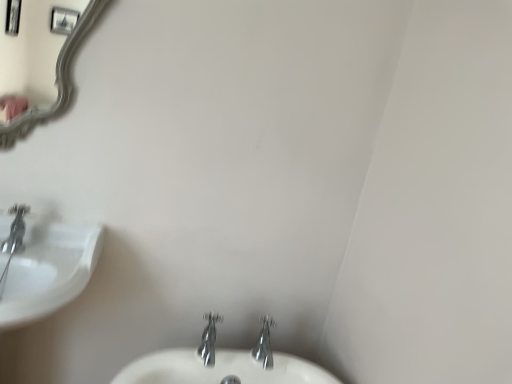
At what (x,y) coordinates should I click in order to perform the action: click on chrome metallic faucet at lower center, placed as the 1th tap when sorted from right to left. Please return your answer as a coordinate pair (x, y). Looking at the image, I should click on (264, 343).

From a real-world perspective, does chrome metallic faucet at lower center, placed as the 1th tap when sorted from right to left, sit lower than polished chrome faucet at center, which ranks as the 1th tap in left-to-right order?

Incorrect, from a real-world perspective, chrome metallic faucet at lower center, placed as the 1th tap when sorted from right to left, is higher than polished chrome faucet at center, which ranks as the 1th tap in left-to-right order.

Considering the relative sizes of chrome metallic faucet at lower center, placed as the 1th tap when sorted from right to left, and polished chrome faucet at center, which ranks as the 1th tap in left-to-right order, in the image provided, is chrome metallic faucet at lower center, placed as the 1th tap when sorted from right to left, taller than polished chrome faucet at center, which ranks as the 1th tap in left-to-right order,?

Yes, chrome metallic faucet at lower center, placed as the 1th tap when sorted from right to left, is taller than polished chrome faucet at center, which ranks as the 1th tap in left-to-right order.

From the image's perspective, is chrome metallic faucet at lower center, placed as the 1th tap when sorted from right to left, located above polished chrome faucet at center, which ranks as the 1th tap in left-to-right order?

No, from the image's perspective, chrome metallic faucet at lower center, placed as the 1th tap when sorted from right to left, is not on top of polished chrome faucet at center, which ranks as the 1th tap in left-to-right order.

How far apart are chrome metallic faucet at lower center, placed as the 1th tap when sorted from right to left, and polished chrome faucet at center, which ranks as the 1th tap in left-to-right order?

They are 7.00 inches apart.

What's the angular difference between polished chrome faucet at center, which ranks as the 1th tap in left-to-right order, and chrome metallic faucet at lower center, arranged as the 2th tap when viewed from the left,'s facing directions?

The angle between the facing direction of polished chrome faucet at center, which ranks as the 1th tap in left-to-right order, and the facing direction of chrome metallic faucet at lower center, arranged as the 2th tap when viewed from the left, is 1.03 degrees.

Is polished chrome faucet at center, which ranks as the 1th tap in left-to-right order, looking in the opposite direction of chrome metallic faucet at lower center, placed as the 1th tap when sorted from right to left?

No, polished chrome faucet at center, which ranks as the 1th tap in left-to-right order, is not facing the opposite direction of chrome metallic faucet at lower center, placed as the 1th tap when sorted from right to left.

Are polished chrome faucet at center, which ranks as the 1th tap in left-to-right order, and chrome metallic faucet at lower center, placed as the 1th tap when sorted from right to left, located far from each other?

No.

Is white glossy sink at left located outside chrome metallic faucet at lower center, arranged as the 2th tap when viewed from the left?

Indeed, white glossy sink at left is completely outside chrome metallic faucet at lower center, arranged as the 2th tap when viewed from the left.

Considering the sizes of objects white glossy sink at left and chrome metallic faucet at lower center, placed as the 1th tap when sorted from right to left, in the image provided, who is thinner, white glossy sink at left or chrome metallic faucet at lower center, placed as the 1th tap when sorted from right to left,?

With smaller width is chrome metallic faucet at lower center, placed as the 1th tap when sorted from right to left.

From the image's perspective, relative to chrome metallic faucet at lower center, placed as the 1th tap when sorted from right to left, is white glossy sink at left above or below?

Clearly, from the image's perspective, white glossy sink at left is above chrome metallic faucet at lower center, placed as the 1th tap when sorted from right to left.

Where is `the 1st tap behind when counting from the white glossy sink at left`? the 1st tap behind when counting from the white glossy sink at left is located at coordinates (209, 339).

Who is taller, white glossy sink at left or polished chrome faucet at center, which ranks as the 1th tap in left-to-right order?

white glossy sink at left.

Between white glossy sink at left and polished chrome faucet at center, which ranks as the 1th tap in left-to-right order, which one has smaller size?

polished chrome faucet at center, which ranks as the 1th tap in left-to-right order, is smaller.

Consider the image. Can you tell me how much white glossy sink at left and polished chrome faucet at center, the second tap when ordered from right to left, differ in facing direction?

There is a 1.59-degree angle between the facing directions of white glossy sink at left and polished chrome faucet at center, the second tap when ordered from right to left.

Is chrome metallic faucet at lower center, arranged as the 2th tap when viewed from the left, smaller than white glossy sink at left?

Yes.

From a real-world perspective, is chrome metallic faucet at lower center, placed as the 1th tap when sorted from right to left, located beneath white glossy sink at left?

No.

Relative to white glossy sink at left, is chrome metallic faucet at lower center, arranged as the 2th tap when viewed from the left, in front or behind?

Visually, chrome metallic faucet at lower center, arranged as the 2th tap when viewed from the left, is located behind white glossy sink at left.

What's the angular difference between chrome metallic faucet at lower center, placed as the 1th tap when sorted from right to left, and white glossy sink at left's facing directions?

They differ by 0.558 degrees in their facing directions.

Between polished chrome faucet at center, which ranks as the 1th tap in left-to-right order, and white glossy sink at left, which one has larger size?

With larger size is white glossy sink at left.

Is polished chrome faucet at center, which ranks as the 1th tap in left-to-right order, thinner than white glossy sink at left?

Yes, polished chrome faucet at center, which ranks as the 1th tap in left-to-right order, is thinner than white glossy sink at left.

Which is more to the right, polished chrome faucet at center, which ranks as the 1th tap in left-to-right order, or white glossy sink at left?

polished chrome faucet at center, which ranks as the 1th tap in left-to-right order, is more to the right.

You are a GUI agent. You are given a task and a screenshot of the screen. Output one action in this format:
    pyautogui.click(x=<x>, y=<y>)
    Task: Click on the tap behind the polished chrome faucet at center, the second tap when ordered from right to left
    The image size is (512, 384).
    Given the screenshot: What is the action you would take?
    pyautogui.click(x=264, y=343)

You are a GUI agent. You are given a task and a screenshot of the screen. Output one action in this format:
    pyautogui.click(x=<x>, y=<y>)
    Task: Click on the tap above the polished chrome faucet at center, which ranks as the 1th tap in left-to-right order (from a real-world perspective)
    The width and height of the screenshot is (512, 384).
    Given the screenshot: What is the action you would take?
    pyautogui.click(x=264, y=343)

Considering their positions, is chrome metallic faucet at lower center, placed as the 1th tap when sorted from right to left, positioned further to polished chrome faucet at center, which ranks as the 1th tap in left-to-right order, than white glossy sink at left?

white glossy sink at left is positioned further to the anchor polished chrome faucet at center, which ranks as the 1th tap in left-to-right order.

Looking at the image, which one is located further to chrome metallic faucet at lower center, placed as the 1th tap when sorted from right to left, polished chrome faucet at center, which ranks as the 1th tap in left-to-right order, or white glossy sink at left?

white glossy sink at left is further to chrome metallic faucet at lower center, placed as the 1th tap when sorted from right to left.

Based on their spatial positions, is polished chrome faucet at center, which ranks as the 1th tap in left-to-right order, or chrome metallic faucet at lower center, placed as the 1th tap when sorted from right to left, further from white glossy sink at left?

Among the two, chrome metallic faucet at lower center, placed as the 1th tap when sorted from right to left, is located further to white glossy sink at left.

When comparing their distances from chrome metallic faucet at lower center, arranged as the 2th tap when viewed from the left, does white glossy sink at left or polished chrome faucet at center, the second tap when ordered from right to left, seem closer?

polished chrome faucet at center, the second tap when ordered from right to left, is closer to chrome metallic faucet at lower center, arranged as the 2th tap when viewed from the left.

Looking at the image, which one is located further to polished chrome faucet at center, the second tap when ordered from right to left, white glossy sink at left or chrome metallic faucet at lower center, placed as the 1th tap when sorted from right to left?

Among the two, white glossy sink at left is located further to polished chrome faucet at center, the second tap when ordered from right to left.

From the image, which object appears to be farther from white glossy sink at left, chrome metallic faucet at lower center, placed as the 1th tap when sorted from right to left, or polished chrome faucet at center, the second tap when ordered from right to left?

chrome metallic faucet at lower center, placed as the 1th tap when sorted from right to left, is positioned further to the anchor white glossy sink at left.

Where is `tap between white glossy sink at left and chrome metallic faucet at lower center, arranged as the 2th tap when viewed from the left, in the horizontal direction`? Image resolution: width=512 pixels, height=384 pixels. tap between white glossy sink at left and chrome metallic faucet at lower center, arranged as the 2th tap when viewed from the left, in the horizontal direction is located at coordinates (209, 339).